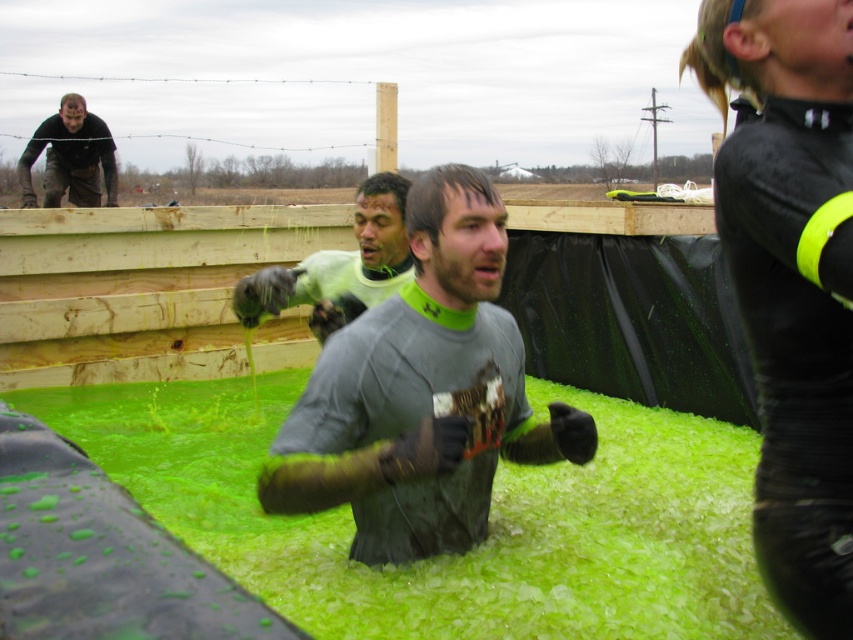
Which is more to the left, green slime at center or matte black shirt at upper left?

matte black shirt at upper left

Based on the photo, which is above, green slime at center or matte black shirt at upper left?

matte black shirt at upper left is higher up.

Consider the image. Who is more forward, [178,499] or [86,188]?

Point [178,499]

Find the location of a particular element. The height and width of the screenshot is (640, 853). green slime at center is located at coordinates (474, 547).

Does gray matte shirt at center come behind green matte shirt at center?

That is False.

Does gray matte shirt at center have a greater height compared to green matte shirt at center?

Yes, gray matte shirt at center is taller than green matte shirt at center.

Is point (445, 186) positioned before point (287, 296)?

Yes, point (445, 186) is closer to viewer.

Where is `gray matte shirt at center`? gray matte shirt at center is located at coordinates (x=422, y=394).

Can you confirm if green matte shirt at center is shorter than matte black shirt at upper left?

Yes, green matte shirt at center is shorter than matte black shirt at upper left.

Which is more to the right, green matte shirt at center or matte black shirt at upper left?

From the viewer's perspective, green matte shirt at center appears more on the right side.

Does point (395, 230) come behind point (57, 120)?

No.

I want to click on green matte shirt at center, so click(338, 266).